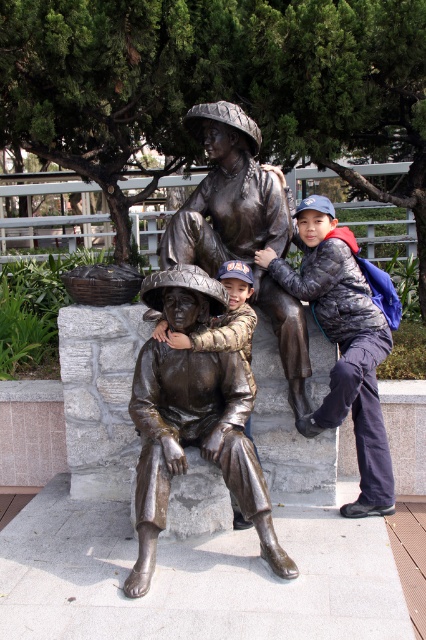
You are a tour guide explaining the statues to visitors. You need to mention both the bronze statue at center and the bronze statue of family at center. Which one is shorter?

The bronze statue at center is shorter than the bronze statue of family at center.